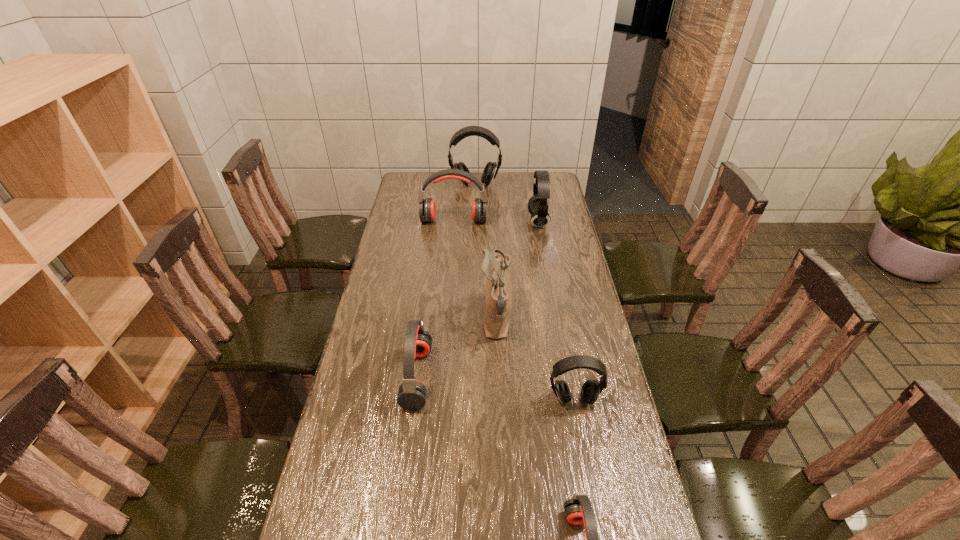
You are a GUI agent. You are given a task and a screenshot of the screen. Output one action in this format:
    pyautogui.click(x=<x>, y=<y>)
    Task: Click on the free space at the left edge of the desktop
    The width and height of the screenshot is (960, 540).
    Given the screenshot: What is the action you would take?
    pyautogui.click(x=412, y=305)

In the image, there is a desktop. What are the coordinates of `free space at the right edge` in the screenshot? It's located at (607, 430).

This screenshot has height=540, width=960. I want to click on free region at the far left corner of the desktop, so click(415, 178).

Locate an element on the screen. The image size is (960, 540). free point between the second biggest red earphone and the farthest black earphone is located at coordinates (446, 281).

At what (x,y) coordinates should I click in order to perform the action: click on blank region between the biggest red earphone and the second nearest black earphone. Please return your answer as a coordinate pair (x, y). This screenshot has width=960, height=540. Looking at the image, I should click on (496, 221).

Identify which object is located as the third nearest to the second biggest black earphone. Please provide its 2D coordinates. Your answer should be formatted as a tuple, i.e. [(x, y)], where the tuple contains the x and y coordinates of a point satisfying the conditions above.

[(498, 297)]

This screenshot has height=540, width=960. I want to click on object that is the sixth closest to the nearest earphone, so click(x=491, y=169).

What are the coordinates of `the second closest earphone to the second nearest red earphone` in the screenshot? It's located at (578, 510).

At what (x,y) coordinates should I click in order to perform the action: click on earphone that stands as the second closest to the second biggest red earphone. Please return your answer as a coordinate pair (x, y). Looking at the image, I should click on (578, 510).

In order to click on black earphone object that ranks as the closest to the second smallest black earphone in this screenshot , I will do `click(491, 169)`.